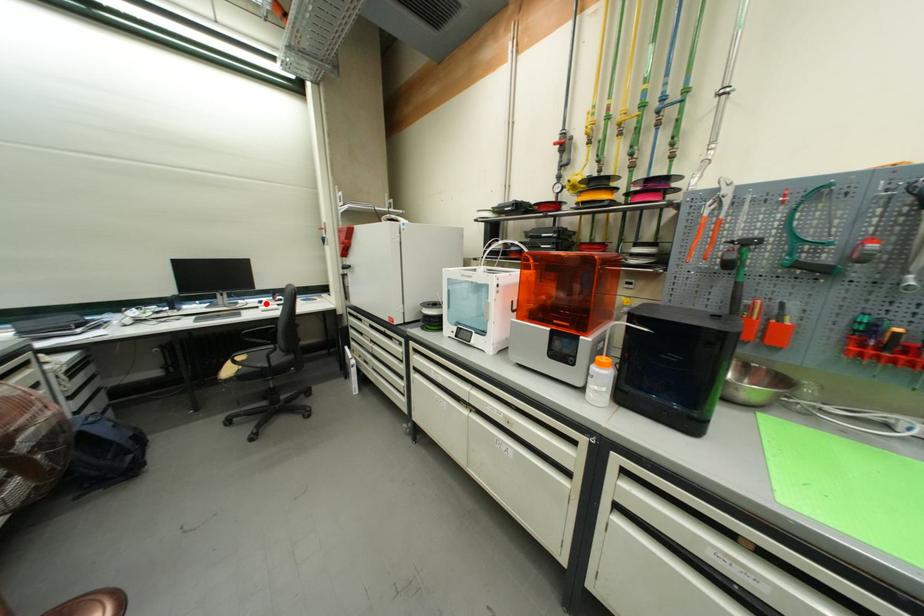
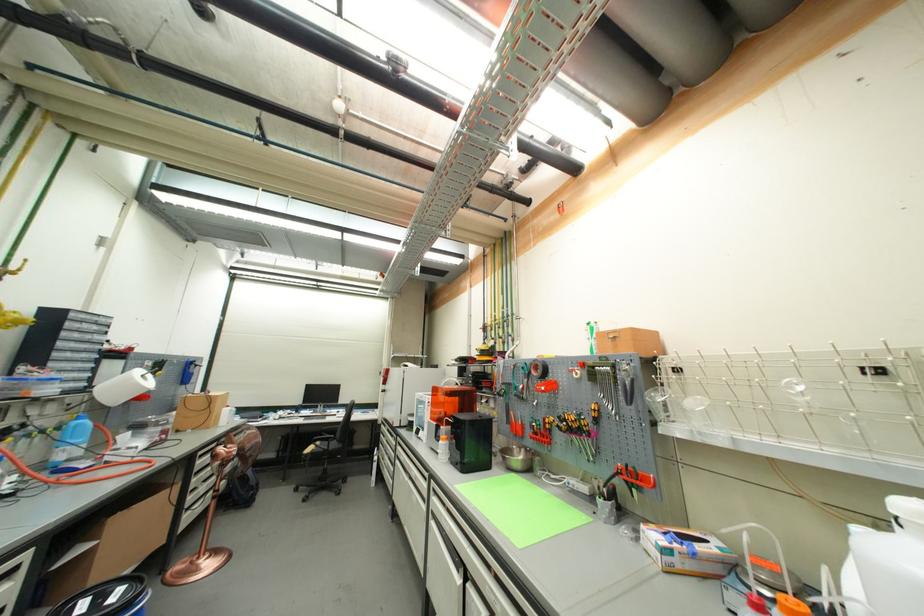
Where in the second image is the point corresponding to the highlighted location from the first image?

(344, 413)